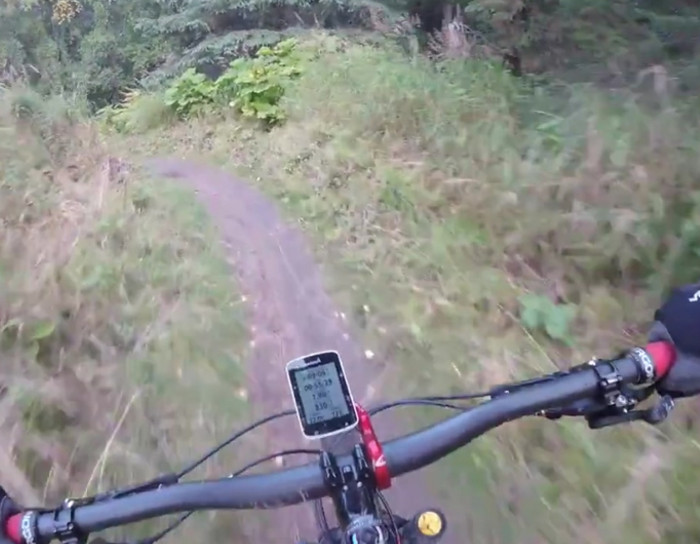
You are a GUI agent. You are given a task and a screenshot of the screen. Output one action in this format:
    pyautogui.click(x=<x>, y=<y>)
    Task: Click on the bar
    The width and height of the screenshot is (700, 544).
    Given the screenshot: What is the action you would take?
    pyautogui.click(x=292, y=480)